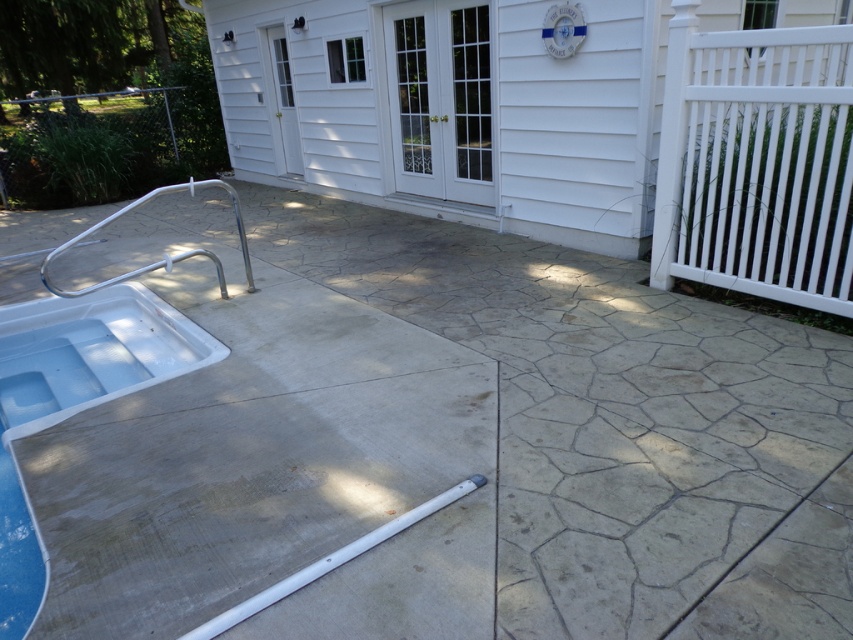
Identify the location of concrete at lower left. (618, 424).

Which is behind, point (680, 532) or point (265, 134)?

The point (265, 134) is more distant.

Where is `concrete at lower left`? concrete at lower left is located at coordinates (618, 424).